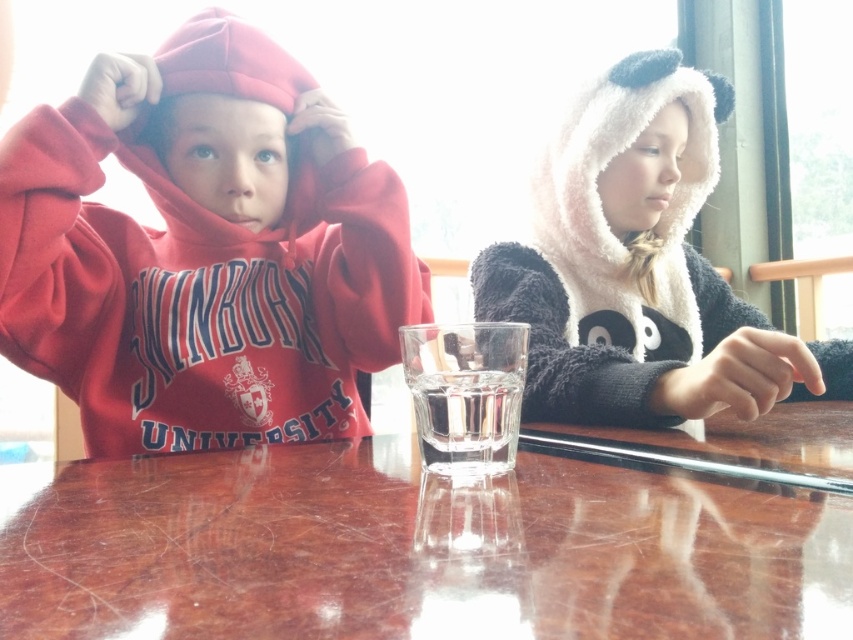
You are a photographer standing between the two children at the table. You want to take a photo of both the matte red hoodie at left and the child on the right without moving either. Can you fit both subjects into the frame if your camera has a 60 cm wide field of view?

The two children are 72.16 centimeters apart, which exceeds the camera field of view of 60 cm. Therefore, you cannot fit both the matte red hoodie at left and the child on the right into the frame without moving them.